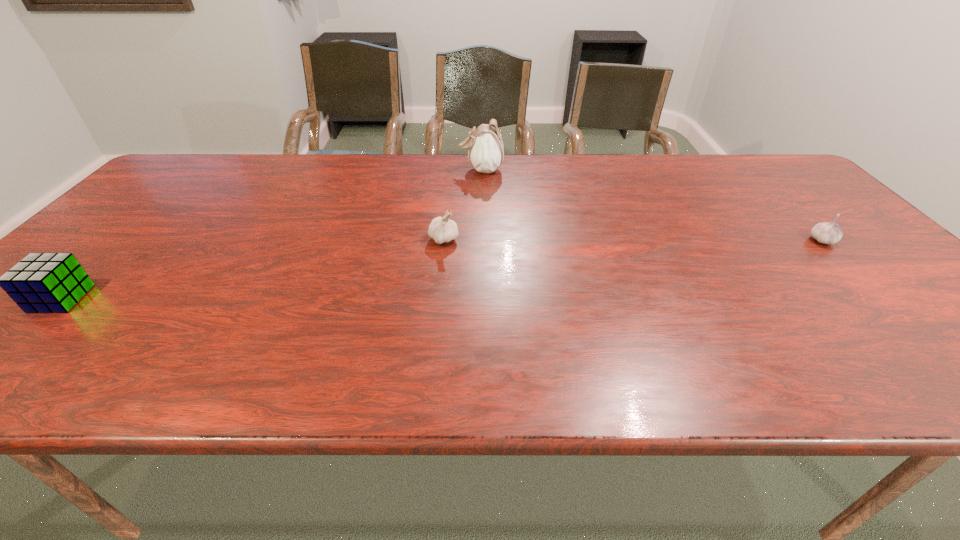
What are the coordinates of `unoccupied area between the nearest object and the shorter garlic` in the screenshot? It's located at (442, 269).

The image size is (960, 540). In order to click on object that ranks as the second closest to the nearest object in this screenshot , I will do `click(486, 152)`.

What are the coordinates of `object that is the closest one to the shorter garlic` in the screenshot? It's located at (486, 152).

The width and height of the screenshot is (960, 540). Find the location of `free space in the image that satisfies the following two spatial constraints: 1. on the front-facing side of the tallest object; 2. on the front side of the left garlic`. free space in the image that satisfies the following two spatial constraints: 1. on the front-facing side of the tallest object; 2. on the front side of the left garlic is located at coordinates (481, 239).

At what (x,y) coordinates should I click in order to perform the action: click on free region that satisfies the following two spatial constraints: 1. on the back side of the shorter garlic; 2. on the front-facing side of the farthest object. Please return your answer as a coordinate pair (x, y). Looking at the image, I should click on (753, 170).

Find the location of a particular element. The image size is (960, 540). vacant space that satisfies the following two spatial constraints: 1. on the front-facing side of the tallest object; 2. on the front side of the left garlic is located at coordinates (481, 239).

The image size is (960, 540). I want to click on vacant position in the image that satisfies the following two spatial constraints: 1. on the front-facing side of the rightmost object; 2. on the left side of the farthest object, so click(x=481, y=240).